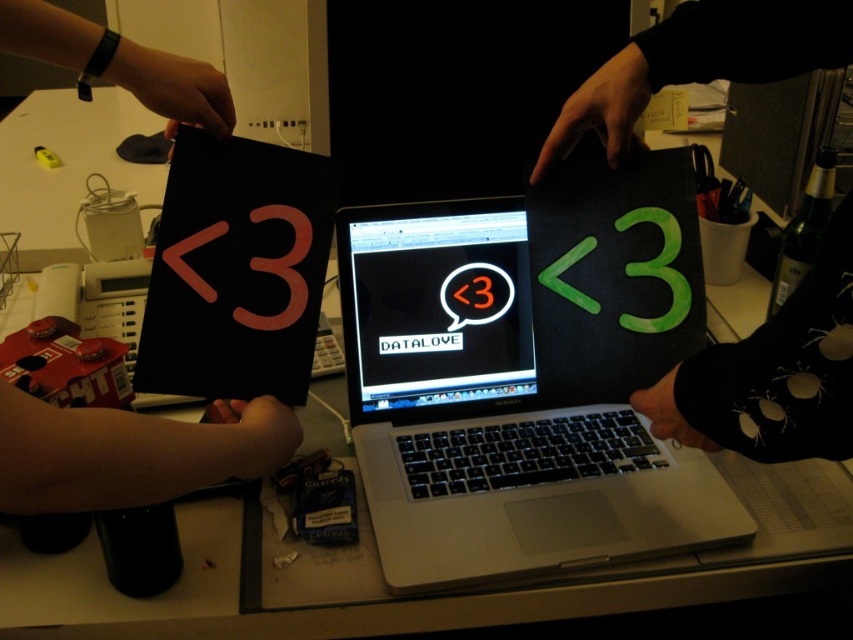
You are setting up a photo shoot and need to ensure that the black matte screen at center and the black fabric wristband at upper left are visible in the final image. Based on their positions, which object should appear higher in the frame?

The black matte screen at center is located above the black fabric wristband at upper left, so it will appear higher in the frame.